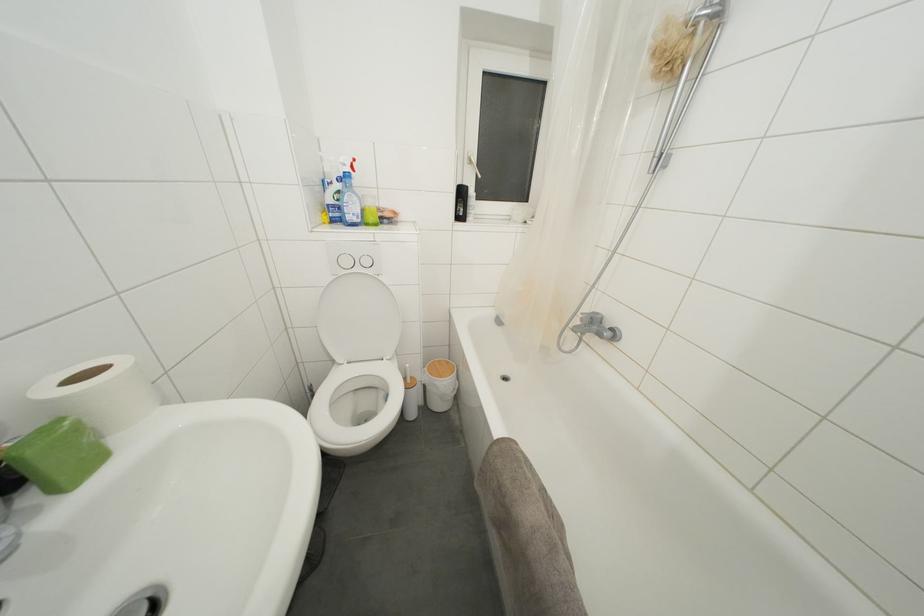
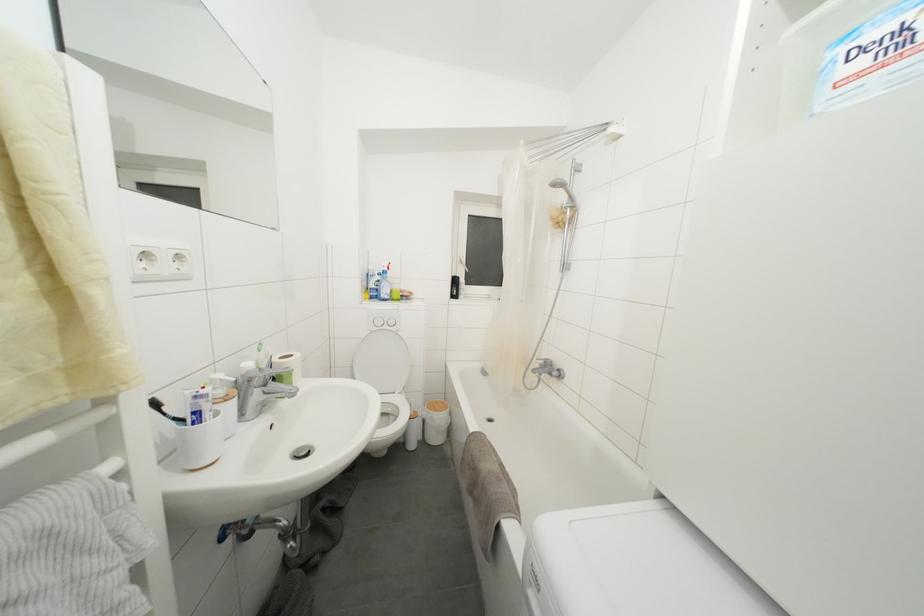
Find the pixel in the second image that matches (361,274) in the first image.

(390, 331)